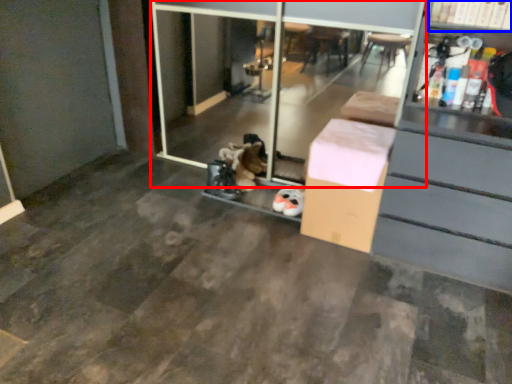
Question: Which object appears farthest to the camera in this image, screen door (highlighted by a red box) or shelf (highlighted by a blue box)?

Choices:
 (A) screen door
 (B) shelf

Answer: (A)